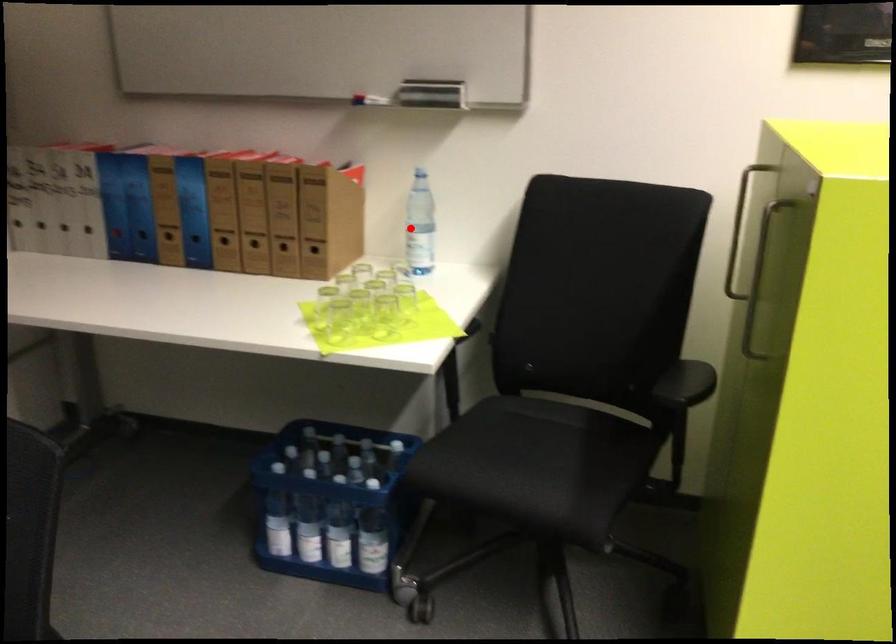
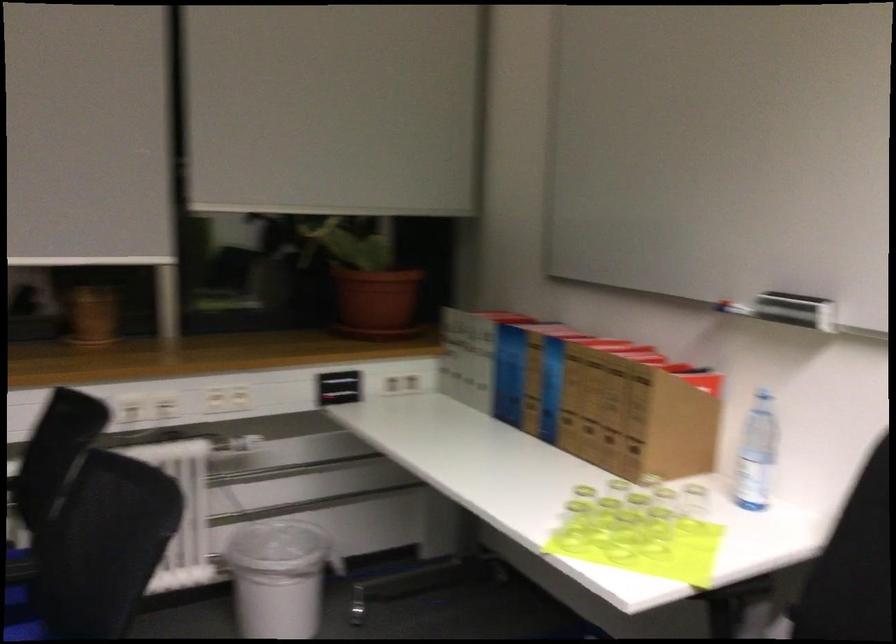
In the second image, find the point that corresponds to the highlighted location in the first image.

(755, 453)